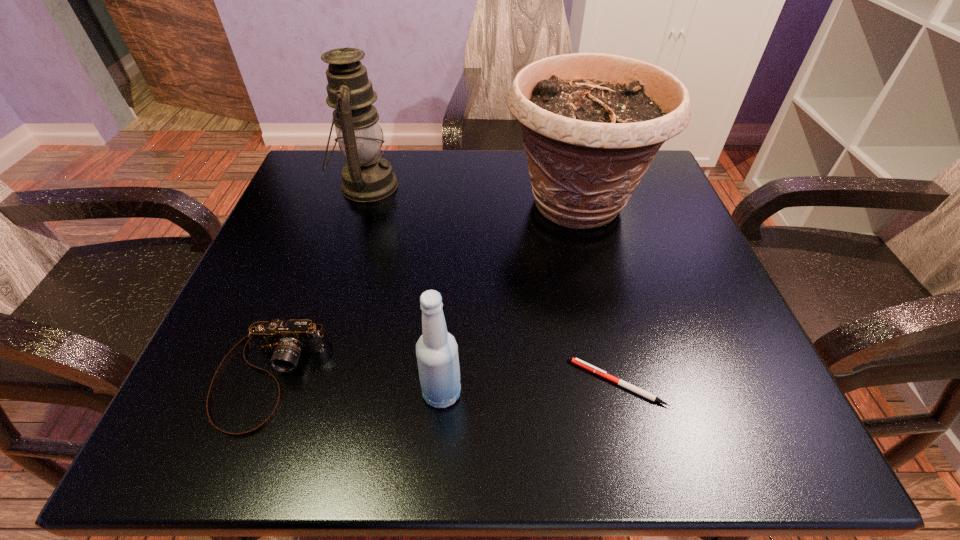
Find the location of a particular element. The height and width of the screenshot is (540, 960). oil lamp is located at coordinates (367, 177).

This screenshot has width=960, height=540. Identify the location of flowerpot. (592, 123).

Locate an element on the screen. the third object from right to left is located at coordinates (436, 350).

At what (x,y) coordinates should I click in order to perform the action: click on bottle. Please return your answer as a coordinate pair (x, y). Looking at the image, I should click on (436, 350).

Find the location of a particular element. The height and width of the screenshot is (540, 960). the fourth tallest object is located at coordinates (286, 340).

The height and width of the screenshot is (540, 960). What are the coordinates of `the shortest object` in the screenshot? It's located at (602, 373).

Identify the location of vacant space situated 0.320m on the front of the oil lamp. (321, 334).

Image resolution: width=960 pixels, height=540 pixels. I want to click on vacant space situated on the left of the flowerpot, so click(438, 204).

The image size is (960, 540). In order to click on free region located on the back of the third object from left to right in this screenshot , I will do `click(447, 309)`.

Locate an element on the screen. free space located 0.380m on the clicker of the pen is located at coordinates (314, 382).